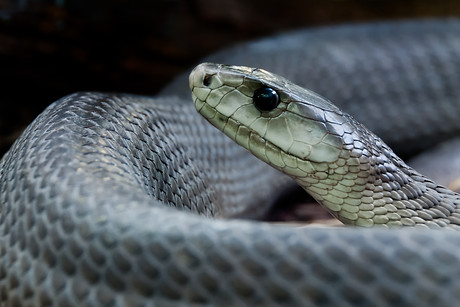
Find the location of `scales`. scales is located at coordinates (371, 170).